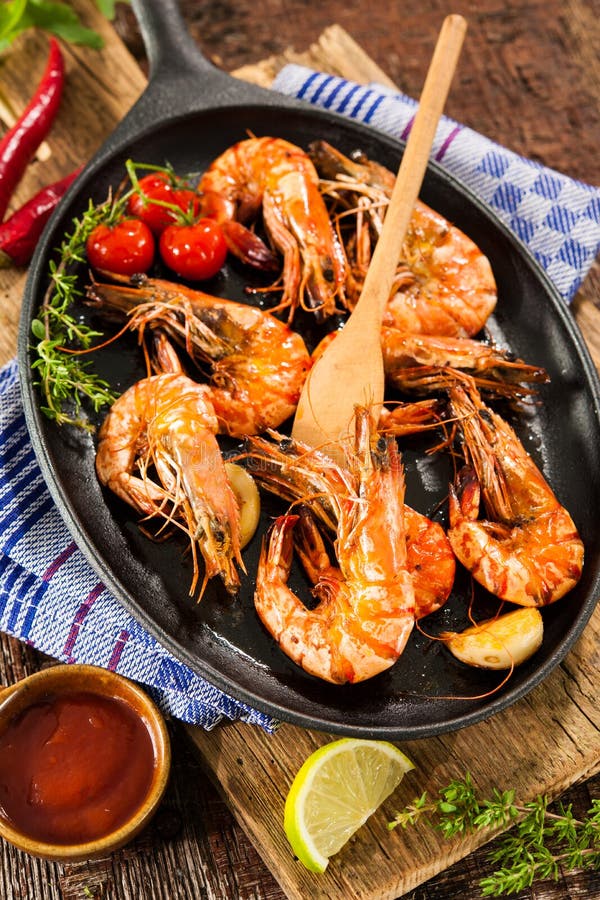
Identify the location of black cast iron skillet. The image size is (600, 900). (208, 114).